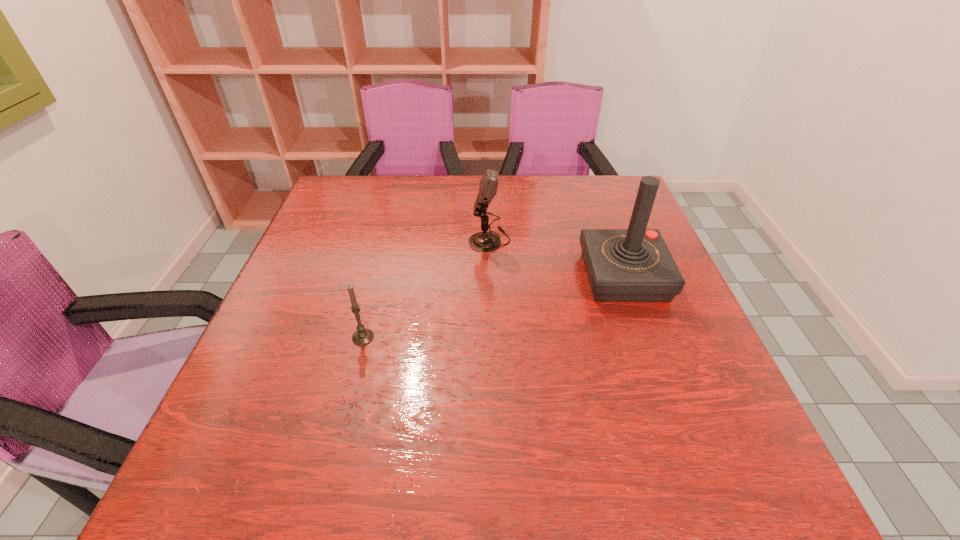
Find the location of `vacant region between the joystick and the microphone`. vacant region between the joystick and the microphone is located at coordinates (557, 258).

The image size is (960, 540). I want to click on free space between the rightmost object and the shortest object, so click(x=493, y=307).

The width and height of the screenshot is (960, 540). Identify the location of free spot between the leftmost object and the microphone. (426, 288).

Locate an element on the screen. vacant area that lies between the rightmost object and the second object from left to right is located at coordinates (557, 258).

In order to click on free space between the second tallest object and the shortest object in this screenshot , I will do `click(426, 288)`.

Locate an element on the screen. The image size is (960, 540). vacant point located between the nearest object and the second shortest object is located at coordinates [x=426, y=288].

The width and height of the screenshot is (960, 540). Identify the location of vacant area between the nearest object and the second tallest object. (426, 288).

Identify the location of free space between the candle and the microphone. This screenshot has width=960, height=540. (426, 288).

Locate an element on the screen. free space between the shortest object and the second shortest object is located at coordinates (426, 288).

I want to click on free space between the rightmost object and the second object from left to right, so click(x=557, y=258).